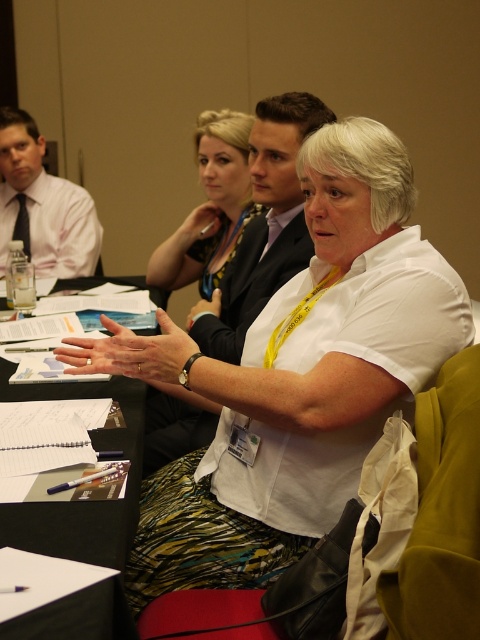
Based on the scene description, which object is smaller in size between the matte white shirt at left and the matte black suit at upper center?

The matte white shirt at left is smaller in size compared to the matte black suit at upper center.